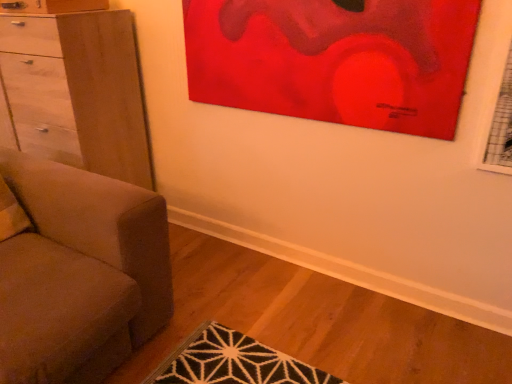
Question: From the image's perspective, is matte red painting at upper center on light brown wood chest of drawers at left?

Choices:
 (A) yes
 (B) no

Answer: (A)

Question: Could you tell me if matte red painting at upper center is turned towards light brown wood chest of drawers at left?

Choices:
 (A) no
 (B) yes

Answer: (A)

Question: Does matte red painting at upper center come in front of light brown wood chest of drawers at left?

Choices:
 (A) no
 (B) yes

Answer: (B)

Question: Is matte red painting at upper center surrounding light brown wood chest of drawers at left?

Choices:
 (A) no
 (B) yes

Answer: (A)

Question: Is matte red painting at upper center looking in the opposite direction of light brown wood chest of drawers at left?

Choices:
 (A) yes
 (B) no

Answer: (B)

Question: Is matte red painting at upper center smaller than light brown wood chest of drawers at left?

Choices:
 (A) no
 (B) yes

Answer: (B)

Question: Can you confirm if light brown wood chest of drawers at left is positioned to the left of matte gray couch at left?

Choices:
 (A) yes
 (B) no

Answer: (A)

Question: Is light brown wood chest of drawers at left positioned in front of matte gray couch at left?

Choices:
 (A) no
 (B) yes

Answer: (A)

Question: Does light brown wood chest of drawers at left have a greater width compared to matte gray couch at left?

Choices:
 (A) no
 (B) yes

Answer: (A)

Question: Is light brown wood chest of drawers at left taller than matte gray couch at left?

Choices:
 (A) no
 (B) yes

Answer: (B)

Question: From a real-world perspective, is light brown wood chest of drawers at left physically below matte gray couch at left?

Choices:
 (A) yes
 (B) no

Answer: (B)

Question: From the image's perspective, would you say light brown wood chest of drawers at left is positioned over matte gray couch at left?

Choices:
 (A) yes
 (B) no

Answer: (A)

Question: From a real-world perspective, is light brown wood chest of drawers at left on top of matte red painting at upper center?

Choices:
 (A) no
 (B) yes

Answer: (A)